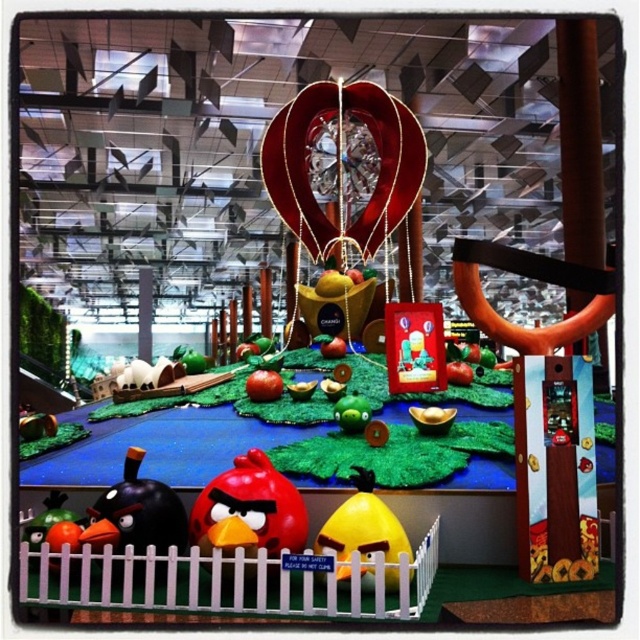
Question: Which point is closer to the camera?

Choices:
 (A) green matte apple at center
 (B) red matte apple at center
 (C) yellow matte/yellowish plastic bird at center
 (D) shiny red phone at center

Answer: (C)

Question: Is matte black bird at lower left below red matte apple at center?

Choices:
 (A) no
 (B) yes

Answer: (B)

Question: Which object is closer to the camera taking this photo?

Choices:
 (A) shiny red bird at center
 (B) shiny red phone at center

Answer: (A)

Question: Considering the real-world distances, which object is farthest from the red matte apple at center?

Choices:
 (A) matte black bird at lower left
 (B) shiny red bird at center
 (C) yellow matte/yellowish plastic bird at center

Answer: (C)

Question: Can you confirm if matte black bird at lower left is smaller than yellow matte/yellowish plastic bird at center?

Choices:
 (A) no
 (B) yes

Answer: (B)

Question: Is matte black bird at lower left above green matte apple at center?

Choices:
 (A) yes
 (B) no

Answer: (B)